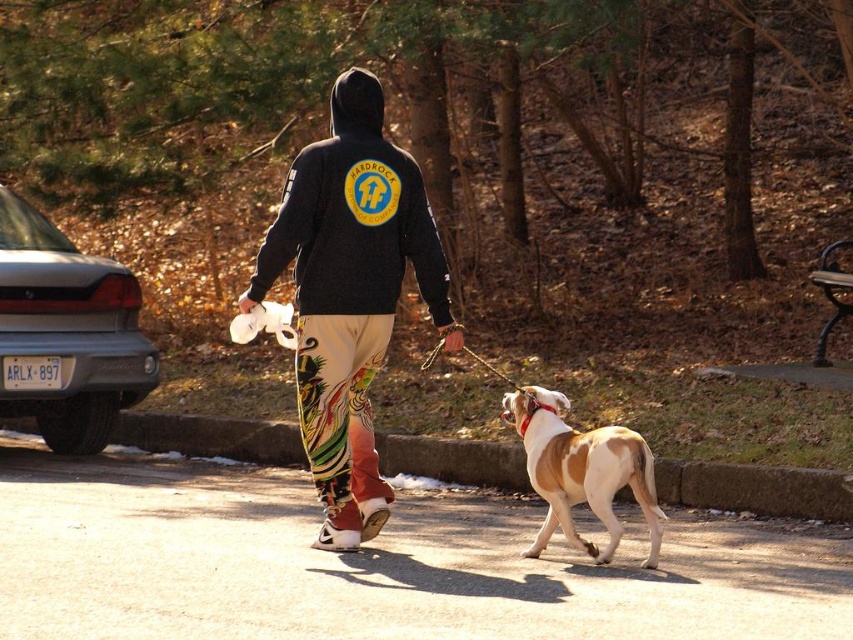
You are standing at the origin point of the coordinate system where the camera is located. The paved area extends from coordinates 0 to 0.5 along the x and y axes, while the grassy area starts beyond 0.5. Can you determine if the black matte hoodie at center is on the paved area or the grassy area based on its coordinates?

The black matte hoodie at center is located at coordinates point (350, 294), which falls within the paved area since both x and y values are below 0.5. Therefore, the black matte hoodie at center is on the paved area.

You are a photographer trying to capture both the black matte hoodie at center and the brown and white fur at center in the same frame. Since they are both at the center, how can you position your camera to ensure both are fully visible?

Position your camera to the right of the scene so that the black matte hoodie at center, which is to the left of the brown and white fur at center, can be fully captured in the frame along with the fur.